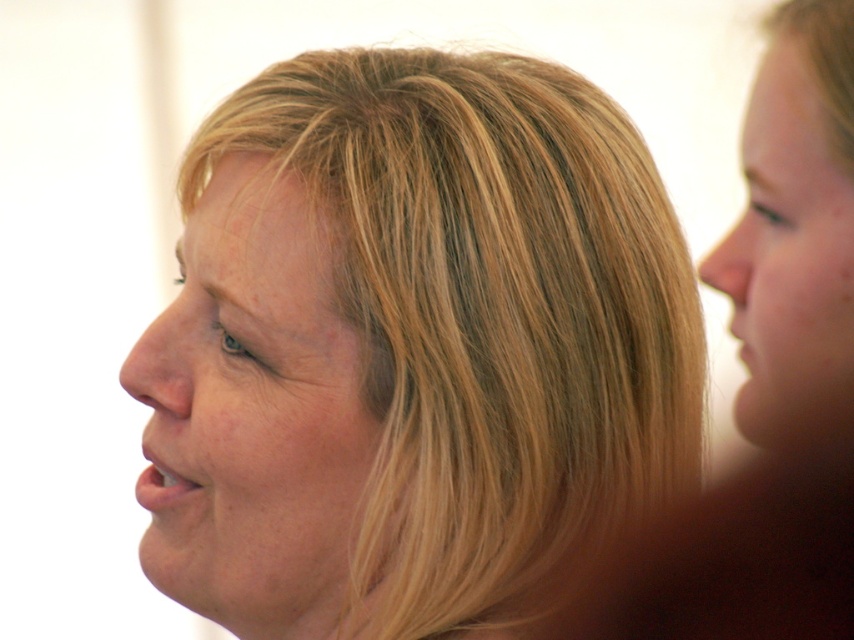
Question: Does smooth skin face at center appear under smooth skin face at right?

Choices:
 (A) no
 (B) yes

Answer: (B)

Question: Estimate the real-world distances between objects in this image. Which object is closer to the blonde hair at center?

Choices:
 (A) smooth skin face at right
 (B) smooth skin face at center

Answer: (B)

Question: Is smooth skin face at center to the right of smooth skin face at right from the viewer's perspective?

Choices:
 (A) no
 (B) yes

Answer: (A)

Question: Considering the relative positions of blonde hair at center and smooth skin face at right in the image provided, where is blonde hair at center located with respect to smooth skin face at right?

Choices:
 (A) right
 (B) left

Answer: (B)

Question: Considering the real-world distances, which object is farthest from the smooth skin face at center?

Choices:
 (A) smooth skin face at right
 (B) blonde hair at center

Answer: (A)

Question: Among these objects, which one is farthest from the camera?

Choices:
 (A) smooth skin face at right
 (B) blonde hair at center
 (C) smooth skin face at center

Answer: (C)